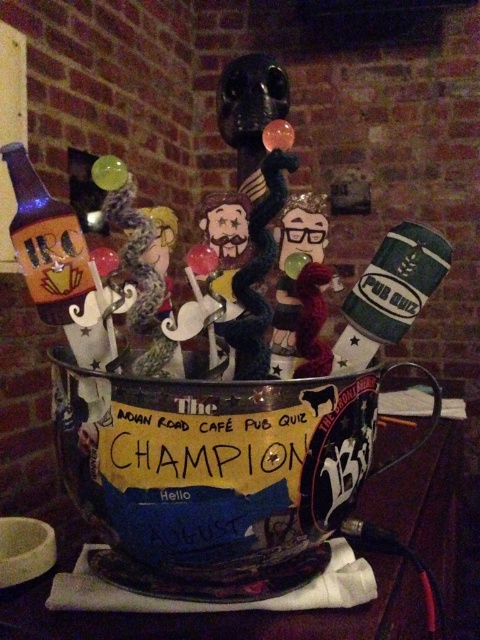
You are a bartender at the pub and need to place a new menu board behind the metallic trophy at center and the matte glass bottle at left. Which object should you move to make space?

The metallic trophy at center is in front of the matte glass bottle at left, so you should move the metallic trophy at center to make space for the menu board behind them.

You are a bartender at the ANDY ROAD CAFE PUB QUIZ CHAMPION event. You need to place a green matte cup at upper right on the counter next to the metallic trophy at center. The counter has limited space, and the distance between them must be exactly 22 inches. Can you fit the cup there without moving the trophy?

The metallic trophy at center is 21.68 inches away from the green matte cup at upper right. Since 21.68 inches is less than 22 inches, the cup can be placed there with a small amount of space remaining.

You are a bartender at the ANDY ROAD CAFE PUB QUIZ CHAMPION event. You need to place a green matte cup at upper right on the same table as the metallic trophy at center. Will the cup fit on the table without overlapping the trophy?

The metallic trophy at center has a greater height compared to green matte cup at upper right. Since the trophy is taller, the cup can be placed on the table without overlapping vertically. However, the horizontal space and table dimensions are not specified, so it depends on the table size.